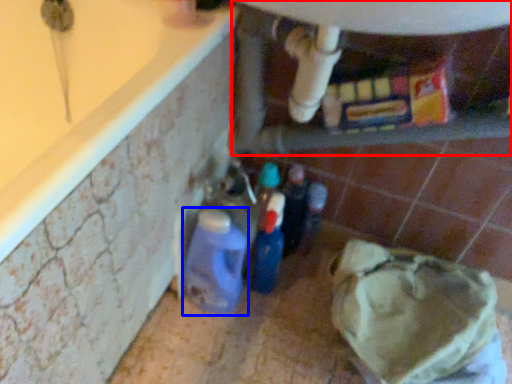
Question: Which point is closer to the camera, water heater (highlighted by a red box) or bottle (highlighted by a blue box)?

Choices:
 (A) water heater
 (B) bottle

Answer: (A)